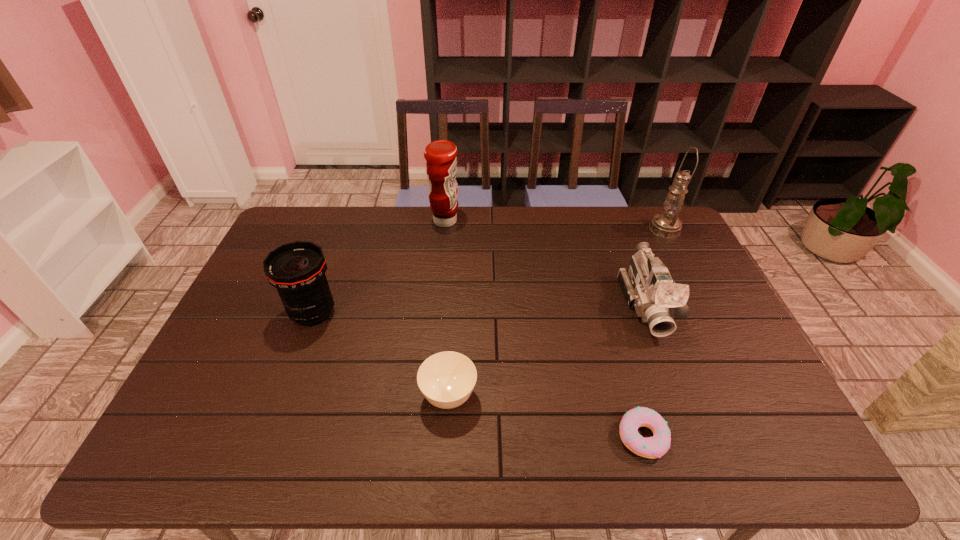
You are a GUI agent. You are given a task and a screenshot of the screen. Output one action in this format:
    pyautogui.click(x=<x>, y=<y>)
    Task: Click on the blank space at the near edge of the desktop
    
    Given the screenshot: What is the action you would take?
    pyautogui.click(x=540, y=431)

Where is `vacant space at the left edge`? This screenshot has height=540, width=960. vacant space at the left edge is located at coordinates (222, 381).

I want to click on vacant space at the right edge of the desktop, so click(x=700, y=302).

Where is `free space between the rightmost object and the condiment`? The height and width of the screenshot is (540, 960). free space between the rightmost object and the condiment is located at coordinates (555, 225).

This screenshot has height=540, width=960. What are the coordinates of `vacant area that lies between the rightmost object and the second shortest object` in the screenshot? It's located at (557, 313).

Find the location of `free area in between the second shortest object and the camcorder`. free area in between the second shortest object and the camcorder is located at coordinates (547, 350).

The width and height of the screenshot is (960, 540). Identify the location of unoccupied position between the condiment and the second object from right to left. (545, 263).

Locate an element on the screen. This screenshot has width=960, height=540. vacant region between the fifth tallest object and the condiment is located at coordinates (447, 308).

Where is `free space between the sugar bowl and the telephoto lens`? The width and height of the screenshot is (960, 540). free space between the sugar bowl and the telephoto lens is located at coordinates (381, 355).

The width and height of the screenshot is (960, 540). I want to click on vacant space in between the oil lamp and the telephoto lens, so click(x=490, y=271).